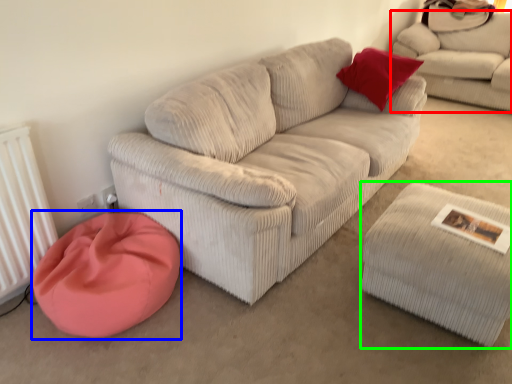
Question: Which object is the farthest from studio couch (highlighted by a red box)? Choose among these: cat bed (highlighted by a blue box) or stool (highlighted by a green box).

Choices:
 (A) cat bed
 (B) stool

Answer: (A)